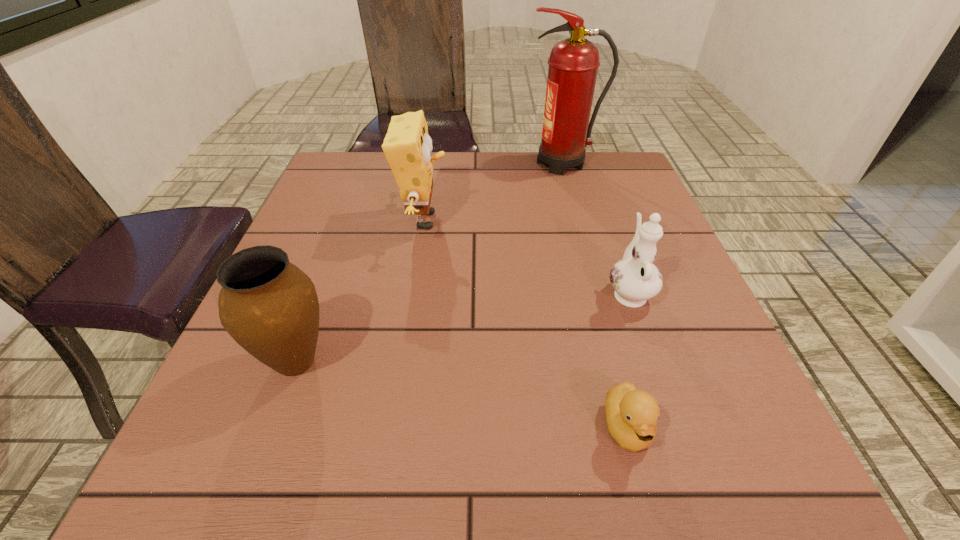
Find the location of a particular element. This screenshot has height=540, width=960. fire extinguisher is located at coordinates (573, 63).

I want to click on the tallest object, so coord(573,63).

This screenshot has height=540, width=960. Find the location of `the second object from left to right`. the second object from left to right is located at coordinates (407, 146).

This screenshot has width=960, height=540. I want to click on the second farthest object, so click(407, 146).

I want to click on urn, so (270, 307).

Locate an element on the screen. The width and height of the screenshot is (960, 540). the leftmost object is located at coordinates (270, 307).

Find the location of a particular element. the third farthest object is located at coordinates (635, 279).

You are a GUI agent. You are given a task and a screenshot of the screen. Output one action in this format:
    pyautogui.click(x=<x>, y=<y>)
    Task: Click on the shortest object
    The image size is (960, 540).
    Given the screenshot: What is the action you would take?
    pyautogui.click(x=632, y=414)

Where is `the nearest object`? The width and height of the screenshot is (960, 540). the nearest object is located at coordinates (632, 414).

The height and width of the screenshot is (540, 960). I want to click on vacant space situated on the front-facing side of the fire extinguisher, so click(434, 164).